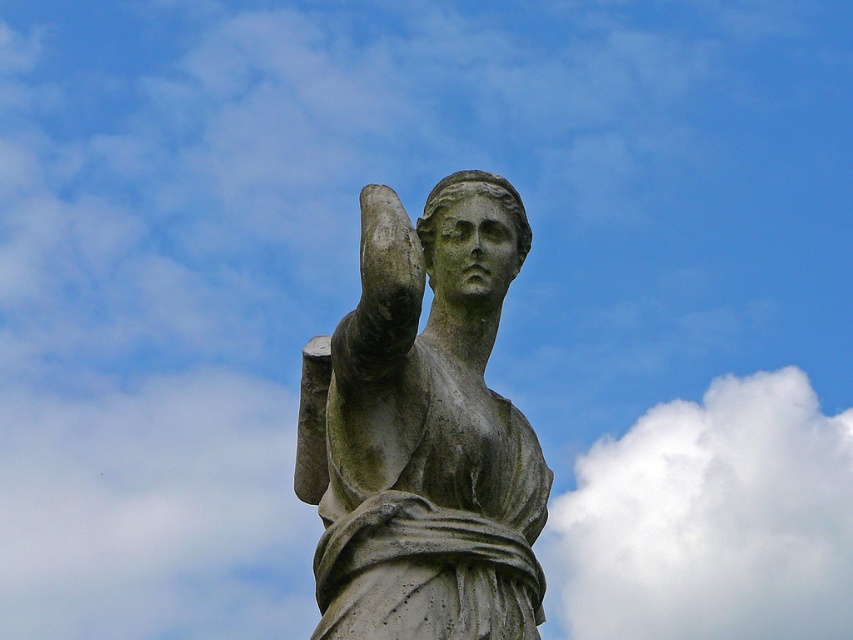
Question: Which object appears farthest from the camera in this image?

Choices:
 (A) white fluffy cloud at upper center
 (B) stone statue at center

Answer: (A)

Question: Does stone statue at center appear over white fluffy cloud at upper center?

Choices:
 (A) yes
 (B) no

Answer: (A)

Question: Considering the relative positions of stone statue at center and white fluffy cloud at upper center in the image provided, where is stone statue at center located with respect to white fluffy cloud at upper center?

Choices:
 (A) left
 (B) right

Answer: (A)

Question: Which point is closer to the camera taking this photo?

Choices:
 (A) [462, 486]
 (B) [640, 564]

Answer: (A)

Question: Is stone statue at center bigger than white fluffy cloud at upper center?

Choices:
 (A) no
 (B) yes

Answer: (A)